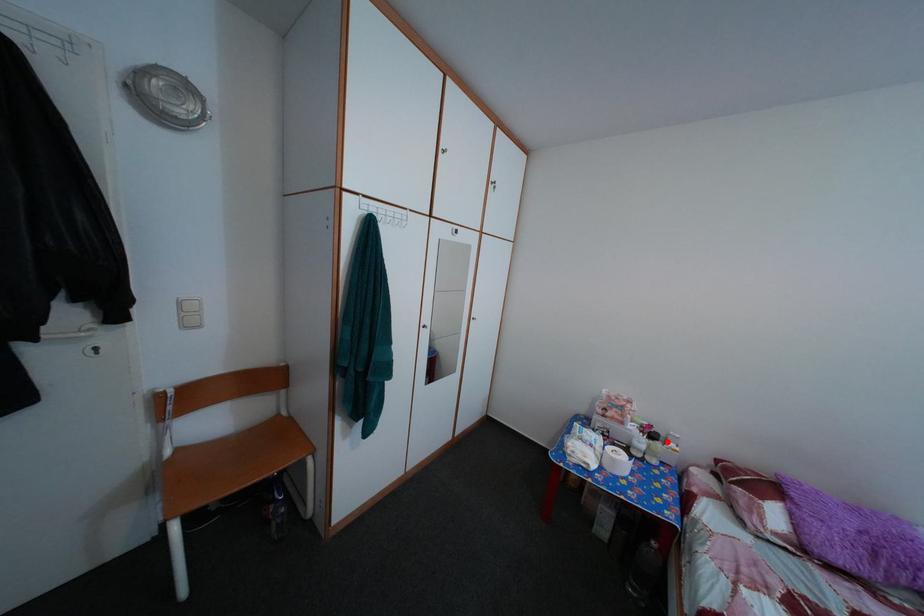
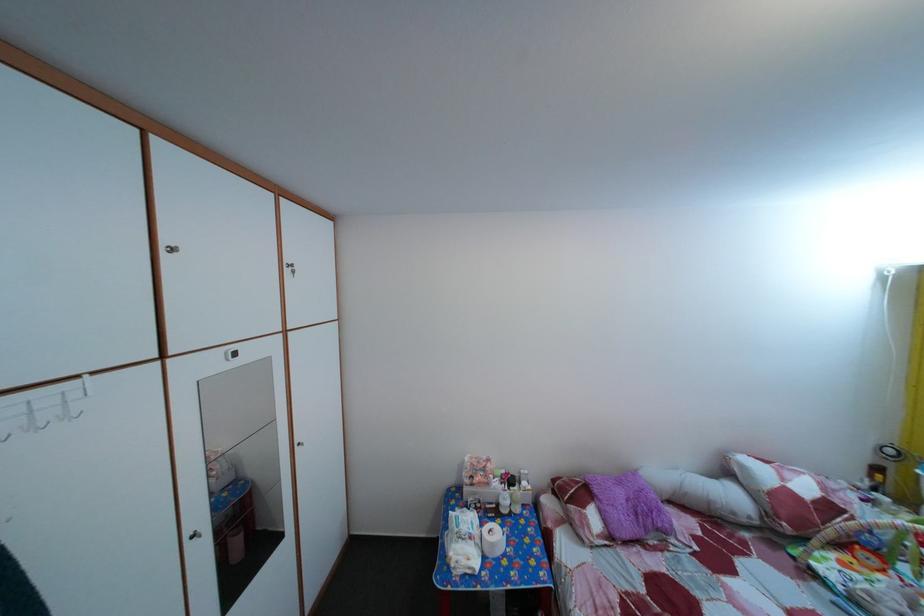
The point at the highlighted location is marked in the first image. Where is the corresponding point in the second image?

(524, 485)